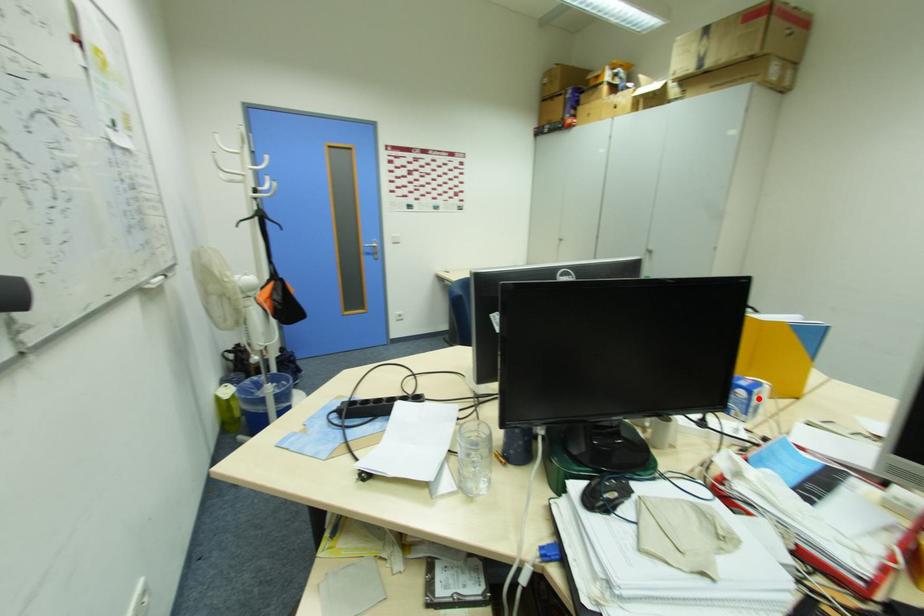
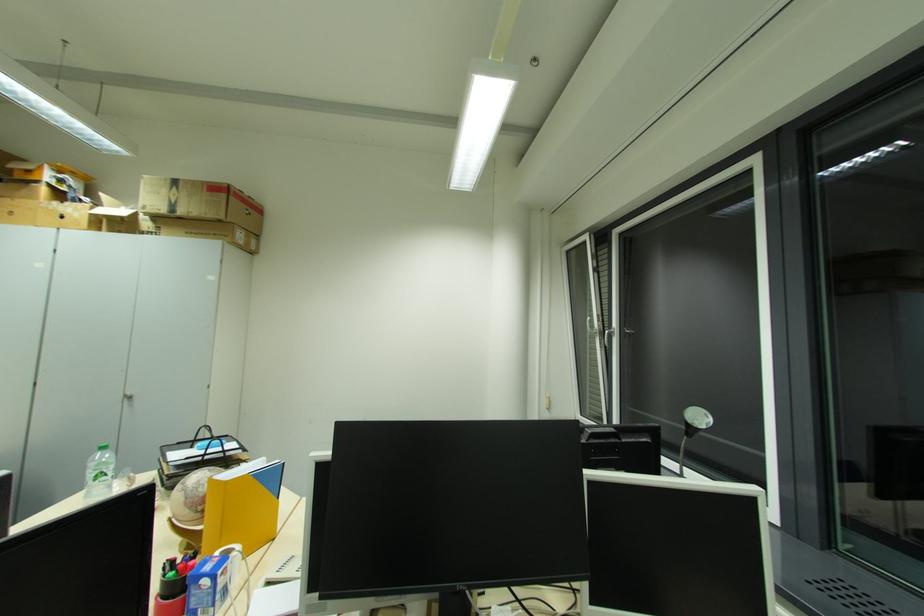
Question: I am providing you with two images of the same scene from different viewpoints. A red point is shown in image1. For the corresponding object point in image2, is it positioned nearer or farther from the camera?

Choices:
 (A) Nearer
 (B) Farther

Answer: (A)